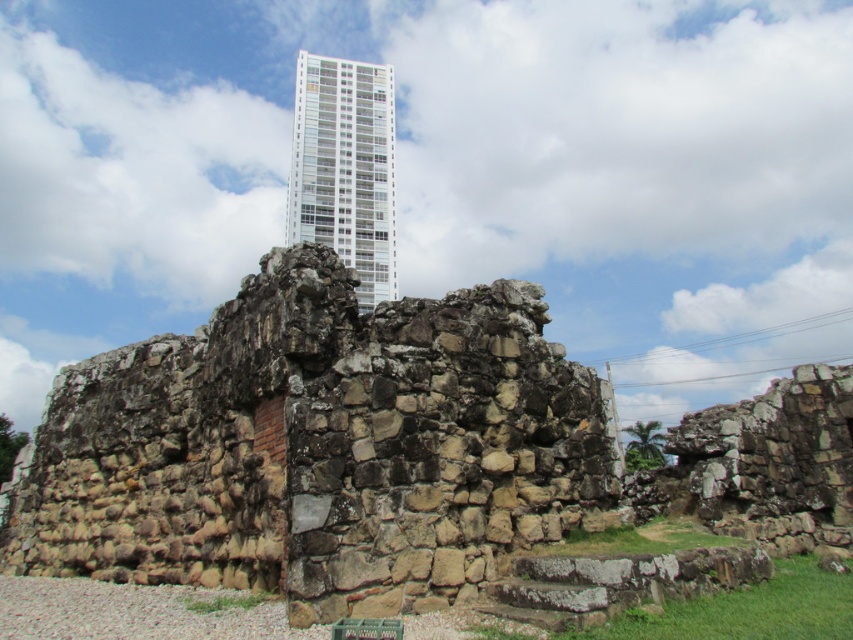
Is brown stone ruins at center wider than white glassy building at upper center?

In fact, brown stone ruins at center might be narrower than white glassy building at upper center.

Who is positioned more to the left, brown stone ruins at center or white glassy building at upper center?

white glassy building at upper center is more to the left.

Locate an element on the screen. This screenshot has width=853, height=640. brown stone ruins at center is located at coordinates pos(318,448).